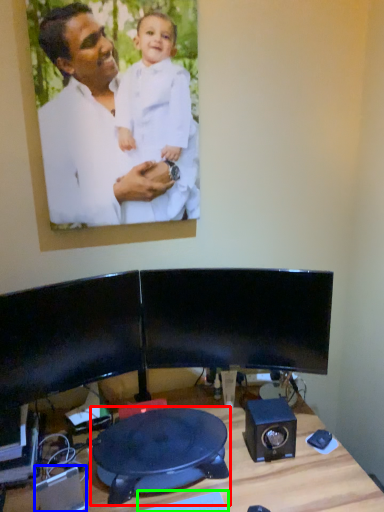
Question: Estimate the real-world distances between objects in this image. Which object is farther from swivel chair (highlighted by a red box), speaker (highlighted by a blue box) or keyboard (highlighted by a green box)?

Choices:
 (A) speaker
 (B) keyboard

Answer: (A)